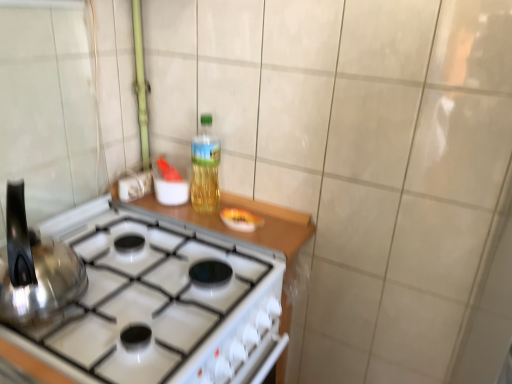
You are a GUI agent. You are given a task and a screenshot of the screen. Output one action in this format:
    pyautogui.click(x=<x>, y=<y>)
    Task: Click on the free space in front of translucent plastic bottle at center
    
    Given the screenshot: What is the action you would take?
    pyautogui.click(x=210, y=225)